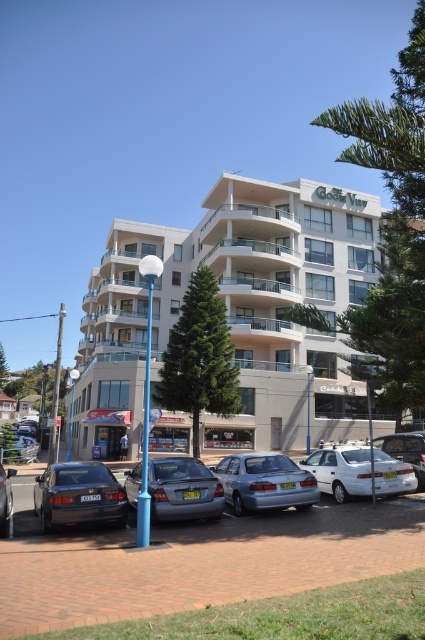
Measure the distance from satin silver sedan at center to metallic silver car at center.

A distance of 4.05 meters exists between satin silver sedan at center and metallic silver car at center.

Does satin silver sedan at center have a lesser height compared to metallic silver car at center?

Correct, satin silver sedan at center is not as tall as metallic silver car at center.

Measure the distance between satin silver sedan at center and camera.

satin silver sedan at center is 10.79 meters from camera.

Find the location of a particular element. This screenshot has height=640, width=425. satin silver sedan at center is located at coordinates (265, 481).

Is beige concrete building at center below metallic silver car at center?

Incorrect, beige concrete building at center is not positioned below metallic silver car at center.

Is point (312, 237) positioned behind point (19, 500)?

That is True.

Describe the element at coordinates (235, 314) in the screenshot. The width and height of the screenshot is (425, 640). I see `beige concrete building at center` at that location.

Locate an element on the screen. The height and width of the screenshot is (640, 425). beige concrete building at center is located at coordinates (235, 314).

Is matte black sedan at lower left wider than matte gray sedan at left?

No, matte black sedan at lower left is not wider than matte gray sedan at left.

Which is behind, point (54, 513) or point (2, 493)?

The point (2, 493) is more distant.

Find the location of a particular element. matte black sedan at lower left is located at coordinates (79, 496).